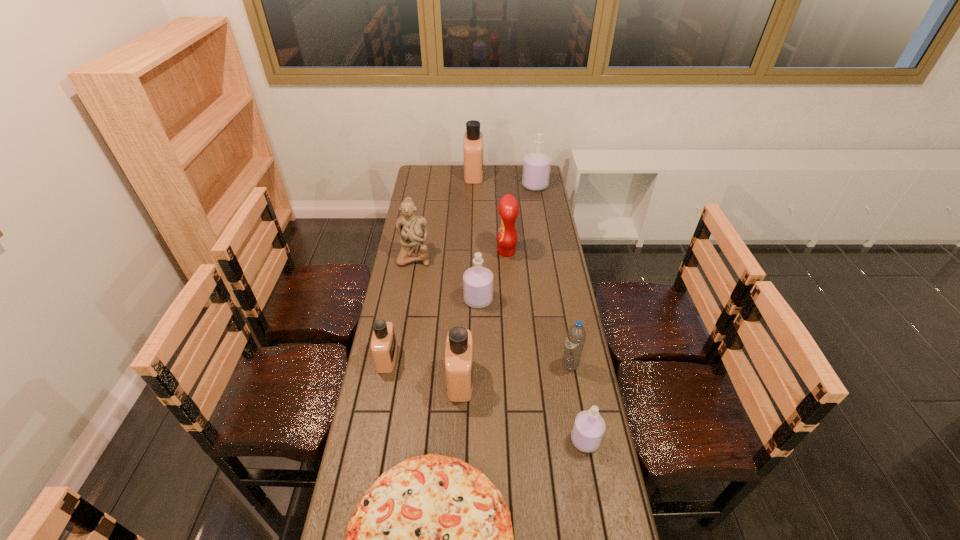
Image resolution: width=960 pixels, height=540 pixels. Find the location of `the farthest beige perfume`. the farthest beige perfume is located at coordinates (473, 138).

Identify the location of the farthest purple perfume. This screenshot has width=960, height=540. (536, 166).

Find the location of `figurine`. figurine is located at coordinates (412, 230).

Find the location of a particular element. The height and width of the screenshot is (540, 960). red condiment is located at coordinates (508, 207).

The width and height of the screenshot is (960, 540). I want to click on the second smallest purple perfume, so click(x=477, y=281).

At what (x,y) coordinates should I click in order to perform the action: click on the fifth farthest object. Please return your answer as a coordinate pair (x, y). This screenshot has width=960, height=540. Looking at the image, I should click on (477, 281).

Image resolution: width=960 pixels, height=540 pixels. In order to click on the second biggest beige perfume in this screenshot , I will do point(459,344).

This screenshot has width=960, height=540. In order to click on blue water bottle in this screenshot , I will do `click(576, 335)`.

Find the location of a particular element. the smallest purple perfume is located at coordinates (589, 426).

You are a GUI agent. You are given a task and a screenshot of the screen. Output one action in this format:
    pyautogui.click(x=<x>, y=<y>)
    Task: Click on the nearest purple perfume
    
    Given the screenshot: What is the action you would take?
    point(589,426)